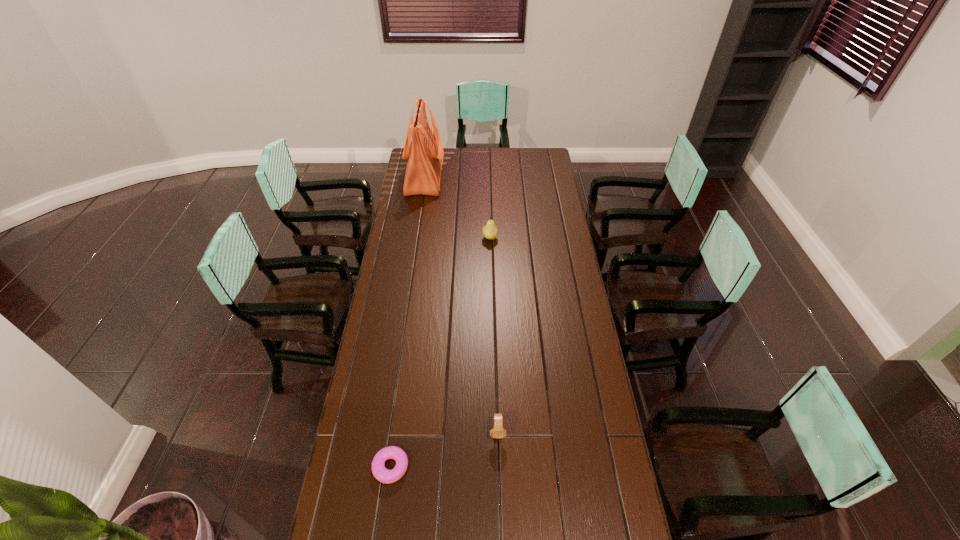
Select which object appears as the third closest to the farthest object. Please provide its 2D coordinates. Your answer should be formatted as a tuple, i.e. [(x, y)], where the tuple contains the x and y coordinates of a point satisfying the conditions above.

[(379, 471)]

You are a GUI agent. You are given a task and a screenshot of the screen. Output one action in this format:
    pyautogui.click(x=<x>, y=<y>)
    Task: Click on the vacant space that satisfies the following two spatial constraints: 1. on the front pocket of the third shortest object; 2. on the right side of the tallest object
    The width and height of the screenshot is (960, 540).
    Given the screenshot: What is the action you would take?
    pyautogui.click(x=416, y=238)

This screenshot has height=540, width=960. In order to click on free space that satisfies the following two spatial constraints: 1. on the front pocket of the shopping bag; 2. on the right side of the shortest object in this screenshot , I will do `click(380, 467)`.